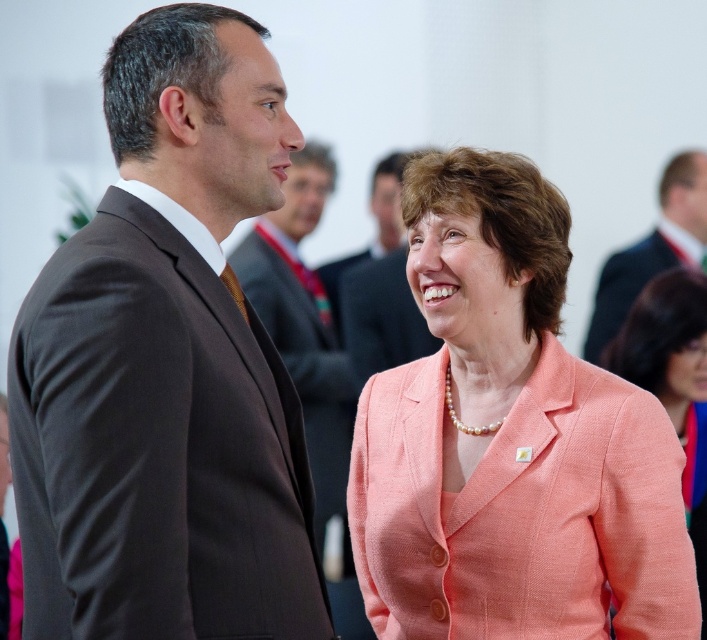
You are a photographer at an event and want to capture a clear shot of the pearl necklace at upper center without the brown suit at center blocking it. What should you do?

Move the camera to the side so that the pearl necklace at upper center is no longer behind the brown suit at center.

Looking at the scene, where is the brown suit at center in relation to the dark suit at upper right?

The brown suit at center is to the left of dark suit at upper right.

You are a photographer standing next to a camera. You need to take a photo of the brown suit at center from a distance of 5 meters. Can you do it?

The brown suit at center and camera are 4.81 meters apart, so yes, the photographer can take the photo from that distance since it is within the required 5 meters.